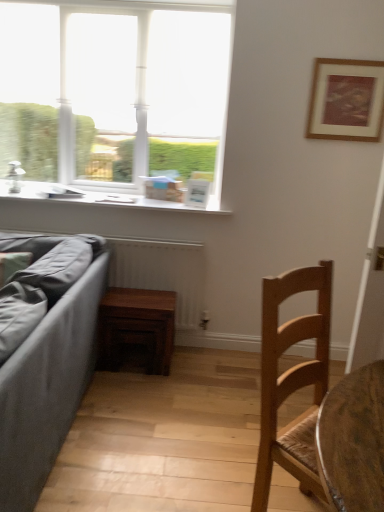
At what (x,y) coordinates should I click in order to perform the action: click on dark wood table at center. Please return your answer as a coordinate pair (x, y). The image size is (384, 512). Looking at the image, I should click on (136, 328).

Locate an element on the screen. The image size is (384, 512). wooden framed artwork at upper right is located at coordinates (346, 100).

What do you see at coordinates (346, 100) in the screenshot? This screenshot has height=512, width=384. I see `wooden framed artwork at upper right` at bounding box center [346, 100].

The image size is (384, 512). I want to click on wooden radiator at lower left, so click(161, 272).

The image size is (384, 512). What do you see at coordinates (115, 94) in the screenshot? I see `white glass window at upper left` at bounding box center [115, 94].

Identify the location of dark wood table at center. (136, 328).

Is white glass window at upper left with dark wood table at center?

There is a gap between white glass window at upper left and dark wood table at center.

Between white glass window at upper left and dark wood table at center, which one has smaller size?

dark wood table at center is smaller.

Who is taller, white glass window at upper left or dark wood table at center?

white glass window at upper left.

Is point (38, 125) less distant than point (157, 321)?

That is False.

Considering their positions, is white glossy window sill at upper left located in front of or behind wooden chair at lower right?

Clearly, white glossy window sill at upper left is behind wooden chair at lower right.

Consider the image. Can you tell me how much white glossy window sill at upper left and wooden chair at lower right differ in facing direction?

The angle between the facing direction of white glossy window sill at upper left and the facing direction of wooden chair at lower right is 46.8 degrees.

From a real-world perspective, which is physically below, white glossy window sill at upper left or wooden chair at lower right?

wooden chair at lower right is physically lower.

The image size is (384, 512). Find the location of `window sill on the left of wooden chair at lower right`. window sill on the left of wooden chair at lower right is located at coordinates (106, 199).

Can you confirm if wooden chair at lower right is thinner than wooden framed artwork at upper right?

Incorrect, the width of wooden chair at lower right is not less than that of wooden framed artwork at upper right.

In the image, is wooden chair at lower right on the left side or the right side of wooden framed artwork at upper right?

In the image, wooden chair at lower right appears on the left side of wooden framed artwork at upper right.

Measure the distance from wooden chair at lower right to wooden framed artwork at upper right.

1.46 meters.

Could wooden framed artwork at upper right be considered to be inside wooden chair at lower right?

No.

From the picture: From a real-world perspective, is dark wood table at center positioned under wooden radiator at lower left based on gravity?

Indeed, from a real-world perspective, dark wood table at center is positioned beneath wooden radiator at lower left.

Are dark wood table at center and wooden radiator at lower left making contact?

No, dark wood table at center is not with wooden radiator at lower left.

In terms of size, does dark wood table at center appear bigger or smaller than wooden radiator at lower left?

Considering their sizes, dark wood table at center takes up less space than wooden radiator at lower left.

Can you confirm if dark wood table at center is shorter than wooden radiator at lower left?

Indeed, dark wood table at center has a lesser height compared to wooden radiator at lower left.

Where is `radiator behind the wooden framed artwork at upper right`? Image resolution: width=384 pixels, height=512 pixels. radiator behind the wooden framed artwork at upper right is located at coordinates (161, 272).

Can you confirm if wooden radiator at lower left is taller than wooden framed artwork at upper right?

Yes, wooden radiator at lower left is taller than wooden framed artwork at upper right.

Based on the photo, is wooden radiator at lower left oriented towards wooden framed artwork at upper right?

No, wooden radiator at lower left is not turned towards wooden framed artwork at upper right.

From a real-world perspective, is wooden radiator at lower left positioned above or below wooden framed artwork at upper right?

Clearly, from a real-world perspective, wooden radiator at lower left is below wooden framed artwork at upper right.

Is wooden framed artwork at upper right aimed at white glass window at upper left?

No, wooden framed artwork at upper right is not turned towards white glass window at upper left.

Is wooden framed artwork at upper right positioned behind white glass window at upper left?

No, wooden framed artwork at upper right is in front of white glass window at upper left.

From a real-world perspective, does wooden framed artwork at upper right sit lower than white glass window at upper left?

Actually, wooden framed artwork at upper right is physically above white glass window at upper left in the real world.

Would you say wooden framed artwork at upper right is inside or outside white glass window at upper left?

wooden framed artwork at upper right cannot be found inside white glass window at upper left.

From a real-world perspective, which is physically below, white glossy window sill at upper left or wooden radiator at lower left?

wooden radiator at lower left.

Is white glossy window sill at upper left wider or thinner than wooden radiator at lower left?

white glossy window sill at upper left is wider than wooden radiator at lower left.

Where is `window on the left of dark wood table at center`? This screenshot has width=384, height=512. window on the left of dark wood table at center is located at coordinates (115, 94).

Where is `chair in front of the white glossy window sill at upper left`? This screenshot has width=384, height=512. chair in front of the white glossy window sill at upper left is located at coordinates coord(292,381).

From the picture: When comparing their distances from dark wood table at center, does wooden framed artwork at upper right or wooden chair at lower right seem further?

wooden framed artwork at upper right is positioned further to the anchor dark wood table at center.

Looking at the image, which one is located closer to wooden radiator at lower left, white glass window at upper left or wooden framed artwork at upper right?

The object closer to wooden radiator at lower left is white glass window at upper left.

Which object lies nearer to the anchor point wooden radiator at lower left, wooden framed artwork at upper right or wooden chair at lower right?

Based on the image, wooden framed artwork at upper right appears to be nearer to wooden radiator at lower left.

Considering their positions, is dark wood table at center positioned closer to white glossy window sill at upper left than wooden framed artwork at upper right?

Among the two, dark wood table at center is located nearer to white glossy window sill at upper left.

Looking at this image, looking at the image, which one is located closer to white glossy window sill at upper left, wooden framed artwork at upper right or dark wood table at center?

Based on the image, dark wood table at center appears to be nearer to white glossy window sill at upper left.

Based on their spatial positions, is white glossy window sill at upper left or dark wood table at center closer to wooden framed artwork at upper right?

white glossy window sill at upper left lies closer to wooden framed artwork at upper right than the other object.

Estimate the real-world distances between objects in this image. Which object is closer to dark wood table at center, wooden radiator at lower left or wooden chair at lower right?

Based on the image, wooden radiator at lower left appears to be nearer to dark wood table at center.

Which object lies nearer to the anchor point wooden radiator at lower left, wooden framed artwork at upper right or white glossy window sill at upper left?

Among the two, white glossy window sill at upper left is located nearer to wooden radiator at lower left.

Where is `radiator between wooden chair at lower right and white glossy window sill at upper left from front to back`? The height and width of the screenshot is (512, 384). radiator between wooden chair at lower right and white glossy window sill at upper left from front to back is located at coordinates (161, 272).

Find the location of a particular element. This screenshot has height=512, width=384. radiator between white glass window at upper left and wooden framed artwork at upper right is located at coordinates (161, 272).

Locate an element on the screen. window sill between white glass window at upper left and wooden radiator at lower left in the up-down direction is located at coordinates (106, 199).

Locate an element on the screen. The height and width of the screenshot is (512, 384). window sill between white glass window at upper left and wooden framed artwork at upper right from left to right is located at coordinates (106, 199).